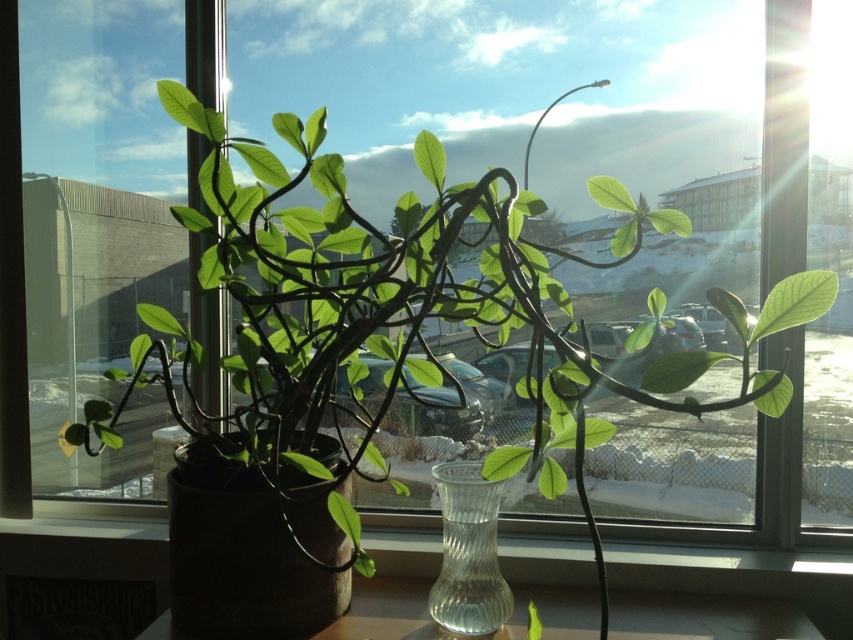
Question: Considering the real-world distances, which object is closest to the transparent glass vase at center?

Choices:
 (A) matte brown vase at center
 (B) clear glass vase at center

Answer: (B)

Question: Does transparent glass vase at center appear under clear glass vase at center?

Choices:
 (A) no
 (B) yes

Answer: (A)

Question: Based on their relative distances, which object is farther from the transparent glass vase at center?

Choices:
 (A) clear glass vase at center
 (B) matte brown vase at center

Answer: (B)

Question: Can you confirm if matte brown vase at center is positioned to the left of clear glass vase at center?

Choices:
 (A) no
 (B) yes

Answer: (A)

Question: Among these objects, which one is nearest to the camera?

Choices:
 (A) transparent glass vase at center
 (B) matte brown vase at center
 (C) clear glass vase at center

Answer: (A)

Question: Is the position of matte brown vase at center more distant than that of clear glass vase at center?

Choices:
 (A) yes
 (B) no

Answer: (A)